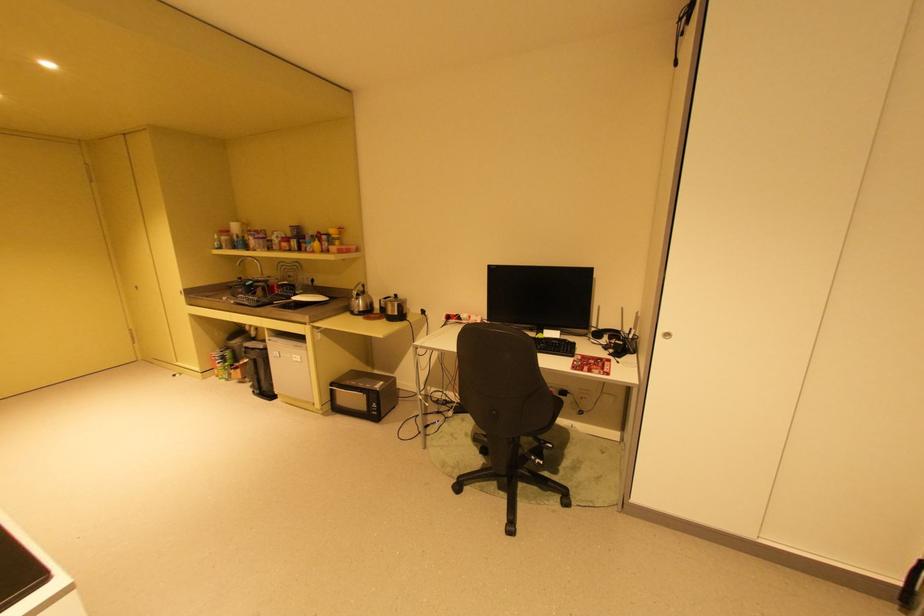
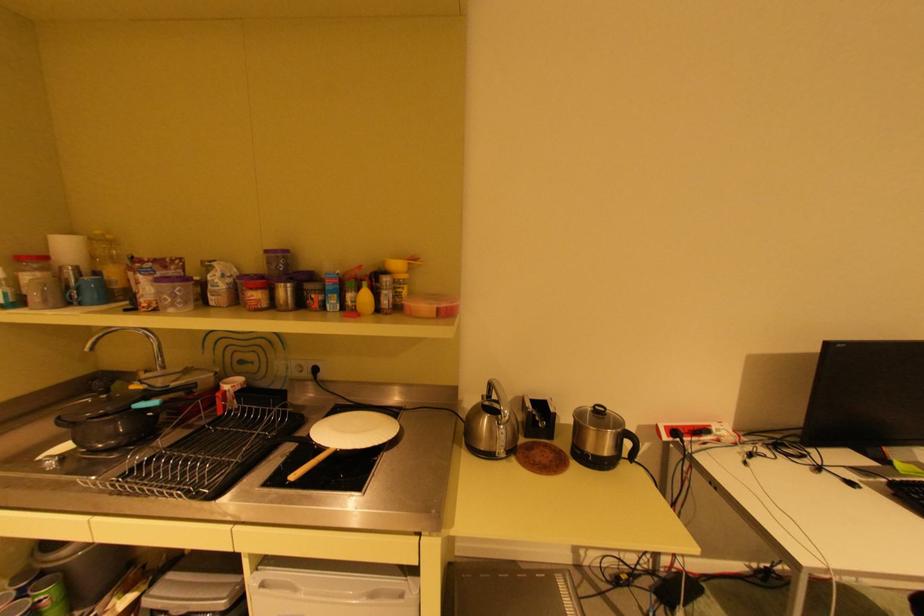
The point at (x=245, y=264) is marked in the first image. Where is the corresponding point in the second image?

(92, 347)